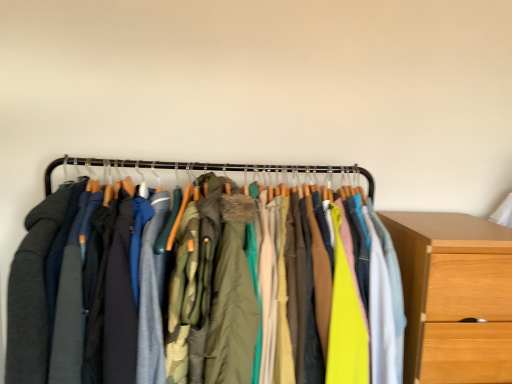
This screenshot has height=384, width=512. Identify the location of wooden chest of drawers at right. (454, 296).

Image resolution: width=512 pixels, height=384 pixels. In order to click on wooden chest of drawers at right in this screenshot , I will do `click(454, 296)`.

Is the surface of wooden chest of drawers at right in direct contact with green textured coat at center?

No, wooden chest of drawers at right is not touching green textured coat at center.

From a real-world perspective, is wooden chest of drawers at right physically located above or below green textured coat at center?

Clearly, from a real-world perspective, wooden chest of drawers at right is below green textured coat at center.

Is wooden chest of drawers at right turned away from green textured coat at center?

No, wooden chest of drawers at right's orientation is not away from green textured coat at center.

Is textured fabric jackets at center outside of green textured coat at center?

textured fabric jackets at center is positioned outside green textured coat at center.

Does textured fabric jackets at center come in front of green textured coat at center?

No, it is not.

Does textured fabric jackets at center have a larger size compared to green textured coat at center?

Indeed, textured fabric jackets at center has a larger size compared to green textured coat at center.

Is point (278, 284) behind point (225, 294)?

Yes, it is.

Locate an element on the screen. The image size is (512, 384). closet lying behind the green textured coat at center is located at coordinates (189, 283).

Considering the relative sizes of green textured coat at center and textured fabric jackets at center in the image provided, is green textured coat at center smaller than textured fabric jackets at center?

Indeed, green textured coat at center has a smaller size compared to textured fabric jackets at center.

Consider the image. Considering the sizes of objects green textured coat at center and textured fabric jackets at center in the image provided, who is shorter, green textured coat at center or textured fabric jackets at center?

textured fabric jackets at center.

Does green textured coat at center have a lesser width compared to textured fabric jackets at center?

Incorrect, the width of green textured coat at center is not less than that of textured fabric jackets at center.

Is green textured coat at center next to wooden chest of drawers at right and touching it?

No, green textured coat at center is not making contact with wooden chest of drawers at right.

From the image's perspective, between green textured coat at center and wooden chest of drawers at right, which one is located above?

green textured coat at center appears higher in the image.

Would you say wooden chest of drawers at right is part of green textured coat at center's contents?

That's incorrect, wooden chest of drawers at right is not inside green textured coat at center.

Is textured fabric jackets at center looking in the opposite direction of wooden chest of drawers at right?

No, textured fabric jackets at center is not facing away from wooden chest of drawers at right.

From a real-world perspective, does textured fabric jackets at center sit lower than wooden chest of drawers at right?

Actually, textured fabric jackets at center is physically above wooden chest of drawers at right in the real world.

From the image's perspective, between textured fabric jackets at center and wooden chest of drawers at right, who is located below?

wooden chest of drawers at right is shown below in the image.

Visually, is wooden chest of drawers at right positioned to the left or to the right of textured fabric jackets at center?

From the image, it's evident that wooden chest of drawers at right is to the right of textured fabric jackets at center.

You are a GUI agent. You are given a task and a screenshot of the screen. Output one action in this format:
    pyautogui.click(x=<x>, y=<y>)
    Task: Click on the closet in front of the wooden chest of drawers at right
    The width and height of the screenshot is (512, 384).
    Given the screenshot: What is the action you would take?
    pyautogui.click(x=189, y=283)

From the image's perspective, is wooden chest of drawers at right located beneath textured fabric jackets at center?

Indeed, from the image's perspective, wooden chest of drawers at right is shown beneath textured fabric jackets at center.

How far apart are wooden chest of drawers at right and textured fabric jackets at center?

The distance of wooden chest of drawers at right from textured fabric jackets at center is 50.96 centimeters.

This screenshot has height=384, width=512. Identify the location of clothing that is in front of the wooden chest of drawers at right. [232, 300].

The image size is (512, 384). In the image, there is a green textured coat at center. Identify the location of closet above it (from the image's perspective). (189, 283).

Which object lies nearer to the anchor point textured fabric jackets at center, green textured coat at center or wooden chest of drawers at right?

Based on the image, green textured coat at center appears to be nearer to textured fabric jackets at center.

Which object lies further to the anchor point green textured coat at center, textured fabric jackets at center or wooden chest of drawers at right?

The object further to green textured coat at center is wooden chest of drawers at right.

Considering their positions, is wooden chest of drawers at right positioned closer to textured fabric jackets at center than green textured coat at center?

Based on the image, green textured coat at center appears to be nearer to textured fabric jackets at center.

Estimate the real-world distances between objects in this image. Which object is further from wooden chest of drawers at right, green textured coat at center or textured fabric jackets at center?

Based on the image, green textured coat at center appears to be further to wooden chest of drawers at right.

Which object lies nearer to the anchor point wooden chest of drawers at right, textured fabric jackets at center or green textured coat at center?

Based on the image, textured fabric jackets at center appears to be nearer to wooden chest of drawers at right.

Based on their spatial positions, is wooden chest of drawers at right or textured fabric jackets at center closer to green textured coat at center?

Based on the image, textured fabric jackets at center appears to be nearer to green textured coat at center.

This screenshot has height=384, width=512. I want to click on clothing between textured fabric jackets at center and wooden chest of drawers at right in the horizontal direction, so click(232, 300).